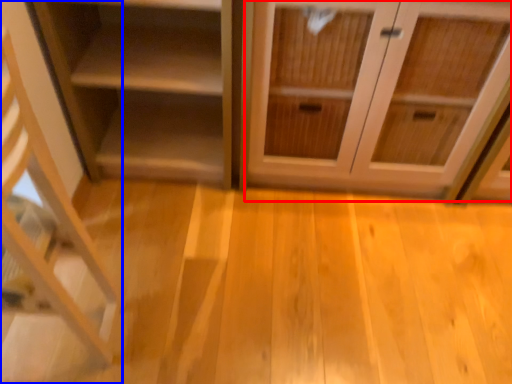
Question: Among these objects, which one is nearest to the camera, cabinetry (highlighted by a red box) or shelf (highlighted by a blue box)?

Choices:
 (A) cabinetry
 (B) shelf

Answer: (B)